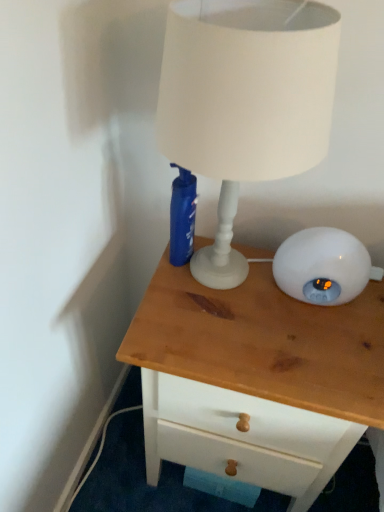
Where is `free space above wooden chest of drawers at center (from a real-world perspective)`? This screenshot has height=512, width=384. free space above wooden chest of drawers at center (from a real-world perspective) is located at coordinates (258, 311).